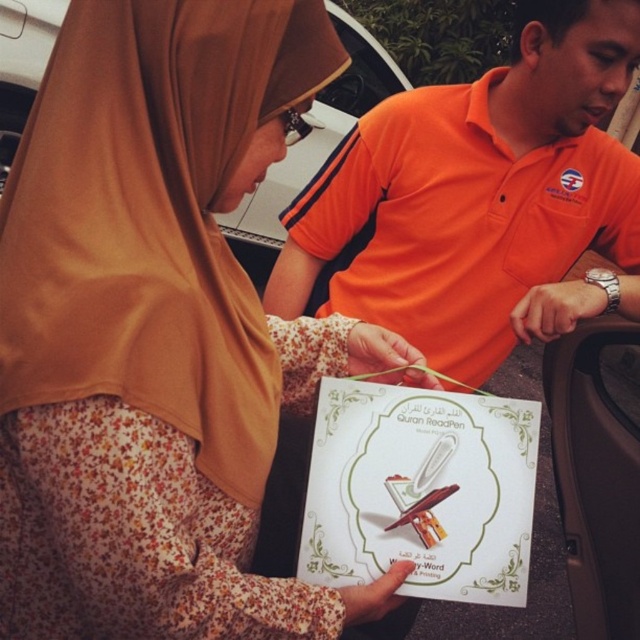
Between white paper at center and orange cotton shirt at center, which one appears on the right side from the viewer's perspective?

orange cotton shirt at center is more to the right.

Which is more to the left, white paper at center or orange cotton shirt at center?

From the viewer's perspective, white paper at center appears more on the left side.

Which is behind, point (176, 189) or point (465, 243)?

The point (465, 243) is more distant.

I want to click on white paper at center, so click(x=150, y=337).

Does point (486, 220) come behind point (1, 140)?

That is False.

Where is `orange cotton shirt at center`? This screenshot has width=640, height=640. orange cotton shirt at center is located at coordinates (481, 198).

Which is in front, point (275, 301) or point (236, 214)?

Point (275, 301)

Image resolution: width=640 pixels, height=640 pixels. Find the location of `orange cotton shirt at center`. orange cotton shirt at center is located at coordinates (481, 198).

Is white paper at center below white plastic car at center?

Yes.

Which is below, white paper at center or white plastic car at center?

white paper at center is below.

Find the location of a particular element. The image size is (640, 640). white paper at center is located at coordinates (150, 337).